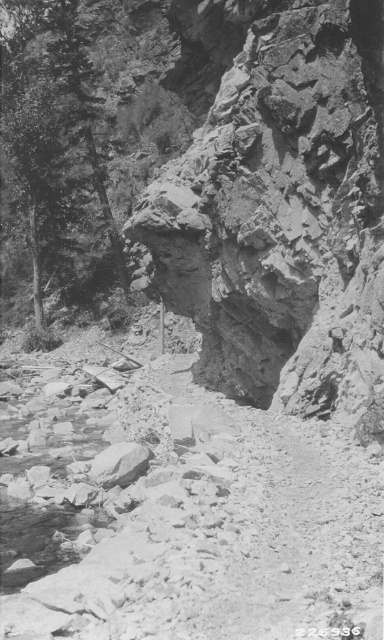
You are a hiker planning to cross the stream in the foreground. You notice the rugged stone cliff at center and the smooth bark tree at upper left. Which object is taller?

The smooth bark tree at upper left is taller than the rugged stone cliff at center.

You are a hiker navigating the rugged landscape and want to cross the stream. The rugged stone cliff at center is your main landmark. Based on its position, which direction should you head to find the shallowest part of the stream?

The rugged stone cliff at center is located at point (281, 214). Since the cliff is positioned towards the lower part of the image, the shallowest part of the stream is likely near its base, so you should head towards the cliff to find the shallowest section.

You are hiking in the rugged landscape and want to take a photo of both the rugged stone cliff at center and the smooth bark tree at upper left. Which object should you position closer to the left side of your camera frame?

The smooth bark tree at upper left should be positioned closer to the left side of your camera frame because the rugged stone cliff at center is to the right of it.